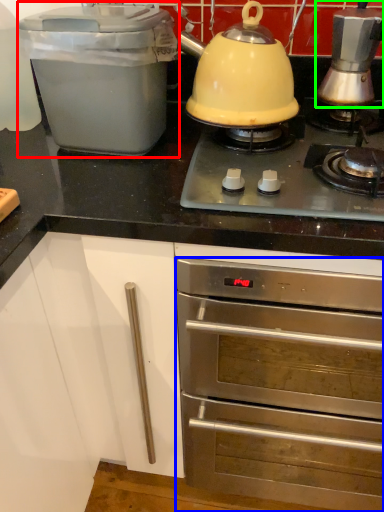
Question: Considering the real-world distances, which object is farthest from kitchen appliance (highlighted by a red box)? oven (highlighted by a blue box) or kitchen appliance (highlighted by a green box)?

Choices:
 (A) oven
 (B) kitchen appliance

Answer: (A)